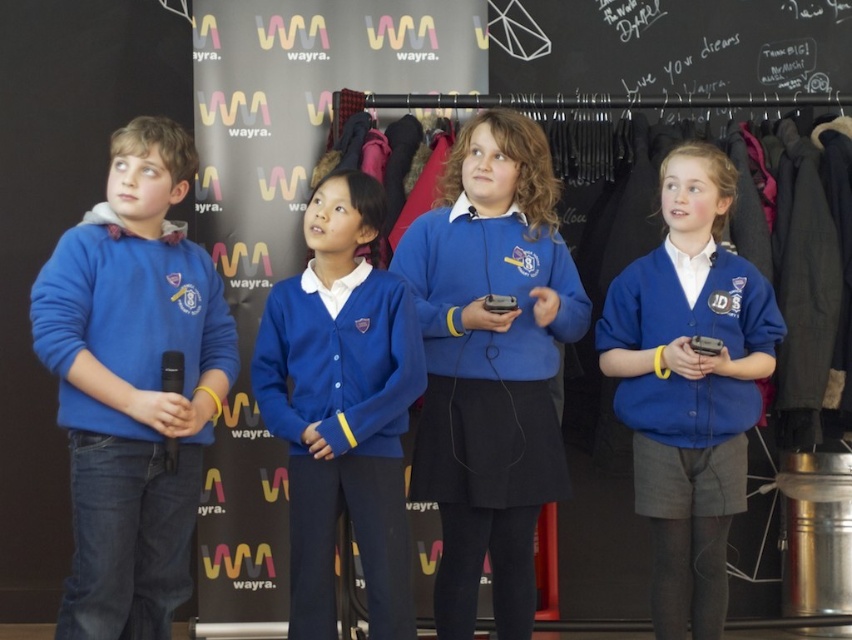
Between point (228, 316) and point (378, 540), which one is positioned behind?

The point (228, 316) is more distant.

This screenshot has height=640, width=852. Describe the element at coordinates (133, 385) in the screenshot. I see `matte blue hoodie at left` at that location.

Find the location of a particular element. matte blue hoodie at left is located at coordinates (133, 385).

In the scene shown: Is matte blue hoodie at left further to the viewer compared to blue fabric uniform at center?

That is False.

Measure the distance between matte blue hoodie at left and camera.

7.78 feet

Find the location of a particular element. matte blue hoodie at left is located at coordinates (133, 385).

Can you confirm if blue fabric uniform at center is wider than blue cardigan at center?

Yes.

Is blue fabric uniform at center bigger than blue cardigan at center?

Correct, blue fabric uniform at center is larger in size than blue cardigan at center.

Is point (661, 362) positioned before point (373, 186)?

No, (661, 362) is behind (373, 186).

At what (x,y) coordinates should I click in order to perform the action: click on blue fabric uniform at center. Please return your answer as a coordinate pair (x, y). Looking at the image, I should click on (689, 385).